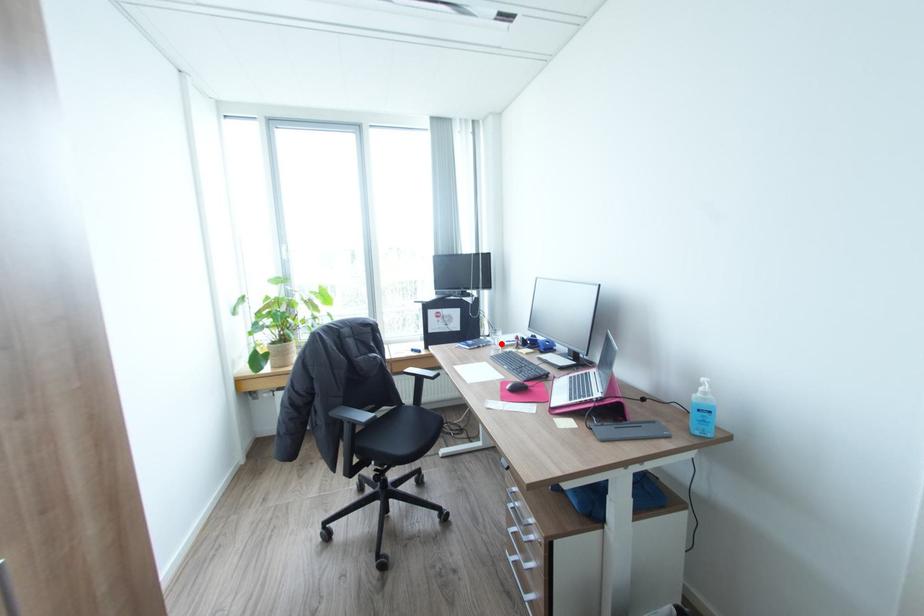
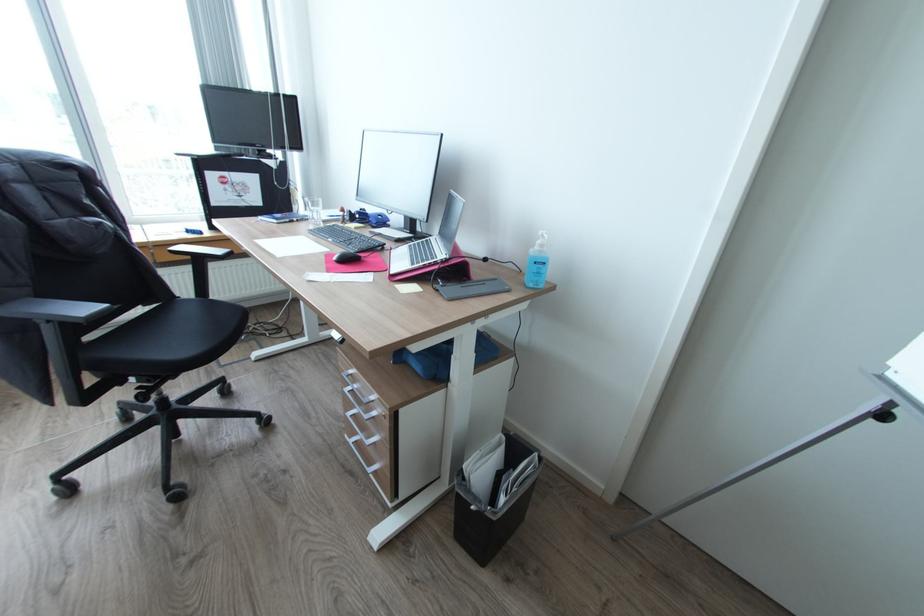
Question: I am providing you with two images of the same scene from different viewpoints. A red point is marked on the first image. Can you still see the location of the red point in image 2?

Choices:
 (A) Yes
 (B) No

Answer: (A)